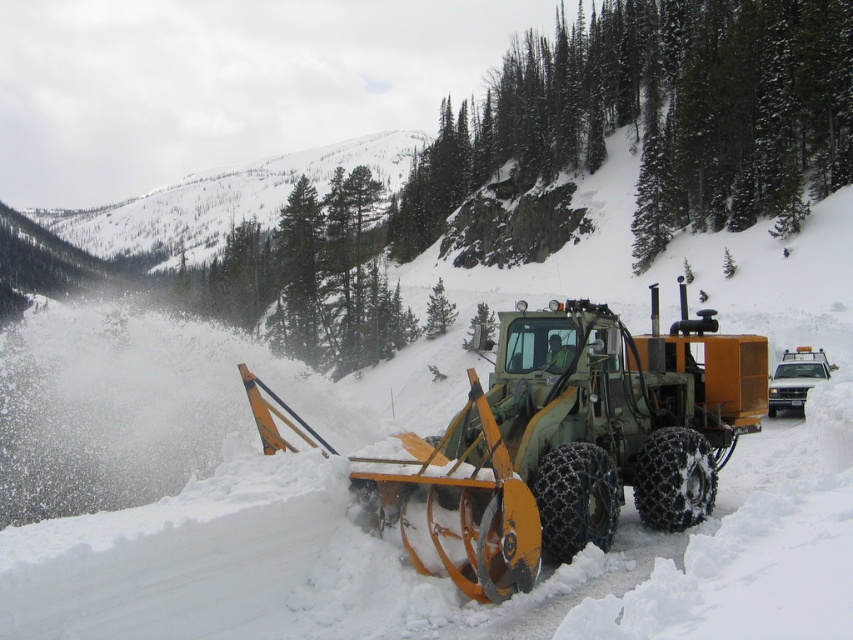
Question: Among these objects, which one is farthest from the camera?

Choices:
 (A) green rubber snowplow at center
 (B) green metallic snowplow at center

Answer: (A)

Question: Does green metallic snowplow at center have a lesser width compared to green rubber snowplow at center?

Choices:
 (A) yes
 (B) no

Answer: (B)

Question: Is green metallic snowplow at center wider than green rubber snowplow at center?

Choices:
 (A) no
 (B) yes

Answer: (B)

Question: Which object appears farthest from the camera in this image?

Choices:
 (A) green rubber snowplow at center
 (B) green metallic snowplow at center

Answer: (A)

Question: Can you confirm if green metallic snowplow at center is positioned to the left of green rubber snowplow at center?

Choices:
 (A) no
 (B) yes

Answer: (B)